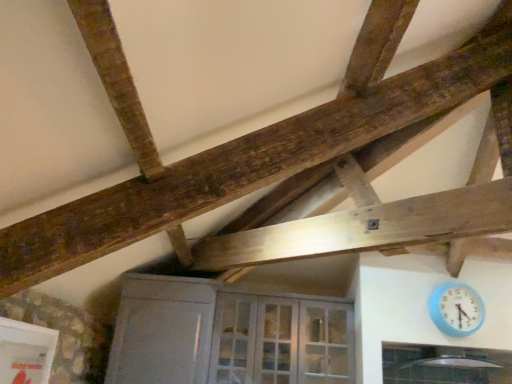
Measure the distance between blue plastic wall clock at lower right and camera.

blue plastic wall clock at lower right and camera are 9.43 feet apart from each other.

Measure the distance between point (441, 317) and camera.

They are 2.88 meters apart.

The height and width of the screenshot is (384, 512). Find the location of `blue plastic wall clock at lower right`. blue plastic wall clock at lower right is located at coordinates (456, 309).

From a real-world perspective, relative to white glass door at center, is clear glass window at lower center vertically above or below?

clear glass window at lower center is below white glass door at center.

Considering the points (455, 376) and (311, 350), which point is behind, point (455, 376) or point (311, 350)?

The point (455, 376) is farther from the camera.

Identify the location of glass door that is above the clear glass window at lower center (from a real-world perspective). (281, 341).

Which is behind, point (417, 373) or point (441, 293)?

The point (417, 373) is more distant.

How many degrees apart are the facing directions of clear glass window at lower center and blue plastic wall clock at lower right?

1.42 degrees separate the facing orientations of clear glass window at lower center and blue plastic wall clock at lower right.

Is clear glass window at lower center not near blue plastic wall clock at lower right?

No, clear glass window at lower center is not far away from blue plastic wall clock at lower right.

Is clear glass window at lower center facing away from blue plastic wall clock at lower right?

No, blue plastic wall clock at lower right is not at the back of clear glass window at lower center.

Between blue plastic wall clock at lower right and white glass door at center, which one appears on the left side from the viewer's perspective?

white glass door at center is more to the left.

Looking at this image, which point is more distant from viewer, (445, 284) or (292, 323)?

Positioned behind is point (292, 323).

From the picture: From the image's perspective, is blue plastic wall clock at lower right on white glass door at center?

Yes.

Between blue plastic wall clock at lower right and white glass door at center, which one has larger width?

white glass door at center.

From the image's perspective, is white glass door at center on blue plastic wall clock at lower right?

No, from the image's perspective, white glass door at center is not on top of blue plastic wall clock at lower right.

What's the angular difference between white glass door at center and blue plastic wall clock at lower right's facing directions?

The angular difference between white glass door at center and blue plastic wall clock at lower right is 1.48 degrees.

Is white glass door at center wider or thinner than blue plastic wall clock at lower right?

white glass door at center is wider than blue plastic wall clock at lower right.

Consider the image. Can you confirm if blue plastic wall clock at lower right is positioned to the left of clear glass window at lower center?

No, blue plastic wall clock at lower right is not to the left of clear glass window at lower center.

From the picture: Which is nearer, (458, 292) or (382, 359)?

Point (458, 292).

Is blue plastic wall clock at lower right positioned with its back to clear glass window at lower center?

No.

Does blue plastic wall clock at lower right have a larger size compared to clear glass window at lower center?

Incorrect, blue plastic wall clock at lower right is not larger than clear glass window at lower center.

Looking at this image, can you confirm if white glass door at center is positioned to the right of clear glass window at lower center?

In fact, white glass door at center is to the left of clear glass window at lower center.

From the image's perspective, is white glass door at center under clear glass window at lower center?

No, from the image's perspective, white glass door at center is not beneath clear glass window at lower center.

Could you tell me if white glass door at center is turned towards clear glass window at lower center?

No, white glass door at center is not turned towards clear glass window at lower center.

Where is `window below the white glass door at center (from the image's perspective)`? The width and height of the screenshot is (512, 384). window below the white glass door at center (from the image's perspective) is located at coordinates (444, 365).

Locate an element on the screen. This screenshot has width=512, height=384. wall clock lying on the right of clear glass window at lower center is located at coordinates (456, 309).

From the image, which object appears to be nearer to clear glass window at lower center, blue plastic wall clock at lower right or white glass door at center?

Based on the image, blue plastic wall clock at lower right appears to be nearer to clear glass window at lower center.

Which object lies nearer to the anchor point white glass door at center, blue plastic wall clock at lower right or clear glass window at lower center?

clear glass window at lower center is closer to white glass door at center.

Which object lies further to the anchor point blue plastic wall clock at lower right, white glass door at center or clear glass window at lower center?

white glass door at center lies further to blue plastic wall clock at lower right than the other object.

Considering their positions, is white glass door at center positioned further to clear glass window at lower center than blue plastic wall clock at lower right?

white glass door at center.

Consider the image. Which object lies nearer to the anchor point blue plastic wall clock at lower right, clear glass window at lower center or white glass door at center?

clear glass window at lower center lies closer to blue plastic wall clock at lower right than the other object.

Looking at the image, which one is located closer to white glass door at center, clear glass window at lower center or blue plastic wall clock at lower right?

clear glass window at lower center lies closer to white glass door at center than the other object.

Identify the location of window located between white glass door at center and blue plastic wall clock at lower right in the left-right direction. (444, 365).